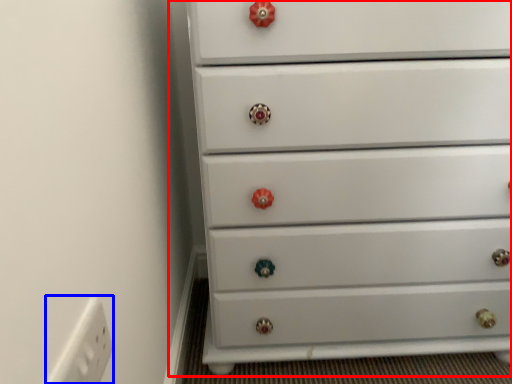
Question: Which object appears farthest to the camera in this image, chest of drawers (highlighted by a red box) or electric outlet (highlighted by a blue box)?

Choices:
 (A) chest of drawers
 (B) electric outlet

Answer: (A)